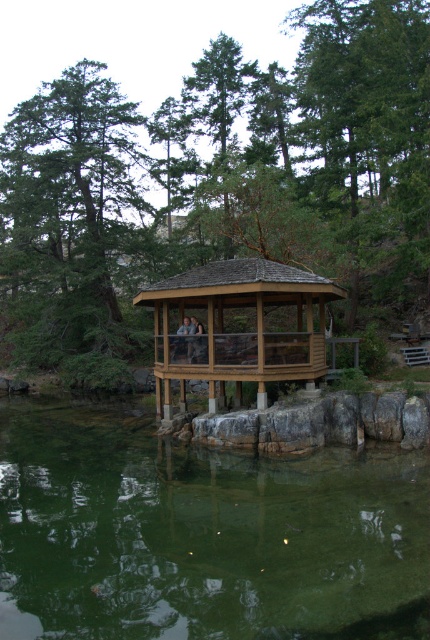
Question: Does green textured tree at center appear over wooden gazebo at center?

Choices:
 (A) no
 (B) yes

Answer: (B)

Question: Considering the real-world distances, which object is farthest from the wooden gazebo at center?

Choices:
 (A) green translucent water at lower center
 (B) brown wooden gazebo at center

Answer: (B)

Question: Which object is closer to the camera taking this photo?

Choices:
 (A) wooden gazebo at center
 (B) green textured tree at center

Answer: (A)

Question: Which object appears farthest from the camera in this image?

Choices:
 (A) wooden gazebo at center
 (B) brown wooden gazebo at center
 (C) green translucent water at lower center
 (D) green textured tree at center

Answer: (D)

Question: Can you confirm if brown wooden gazebo at center is thinner than wooden gazebo at center?

Choices:
 (A) no
 (B) yes

Answer: (A)

Question: Can you confirm if green textured tree at center is positioned to the left of wooden gazebo at center?

Choices:
 (A) yes
 (B) no

Answer: (A)